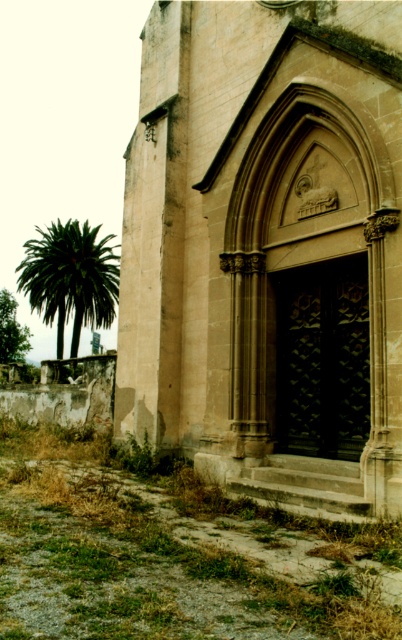
Who is positioned more to the left, beige stone chapel at center or green leafy palm at left?

green leafy palm at left

Is beige stone chapel at center below green leafy palm at left?

Yes.

Does point (244, 458) come closer to viewer compared to point (92, 275)?

That is True.

Identify the location of beige stone chapel at center. This screenshot has height=640, width=402. (268, 248).